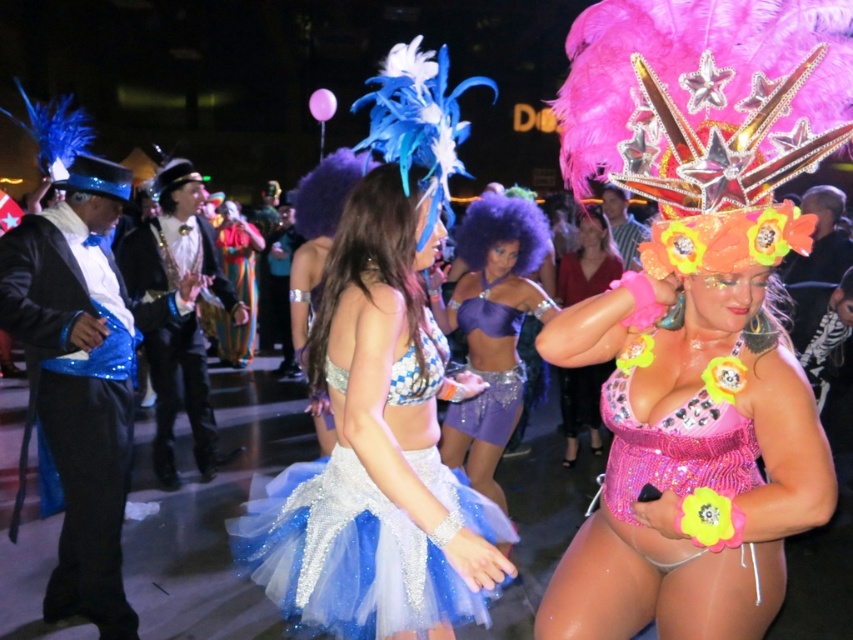
You are a photographer at the event and want to capture both the pink sequined bikini at right and the purple sequined dress at center in a single shot. Based on their positions, which one is lower in the frame?

The pink sequined bikini at right is located below the purple sequined dress at center, so it is lower in the frame.

You are a photographer at the event and want to capture a photo where both the glittery blue tutu at center and the purple sequined dress at center are visible. Based on their positions, which one should you focus on first to ensure both are in frame?

Since the glittery blue tutu at center is below the purple sequined dress at center, you should focus on the purple sequined dress at center first to ensure both are in frame.

You are a photographer setting up for a group photo. You need to position the glittery blue tutu at center and the purple sequined dress at center so that both fit within the frame. Considering their widths, which object should be placed closer to the edges to ensure they both fit?

The glittery blue tutu at center is wider than the purple sequined dress at center. To ensure both fit within the frame, the wider glittery blue tutu at center should be placed closer to the edges, allowing the narrower purple sequined dress at center to occupy the central area.